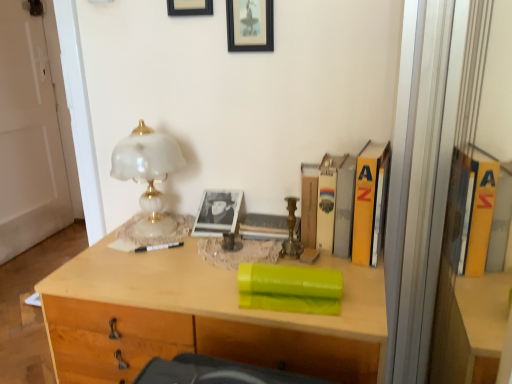
Where is `free spot to the right of black plastic pen at center`? Image resolution: width=512 pixels, height=384 pixels. free spot to the right of black plastic pen at center is located at coordinates (212, 248).